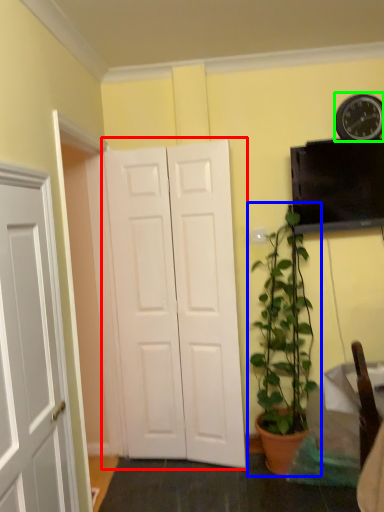
Question: Which object is positioned farthest from door (highlighted by a red box)? Select from houseplant (highlighted by a blue box) and clock (highlighted by a green box).

Choices:
 (A) houseplant
 (B) clock

Answer: (B)